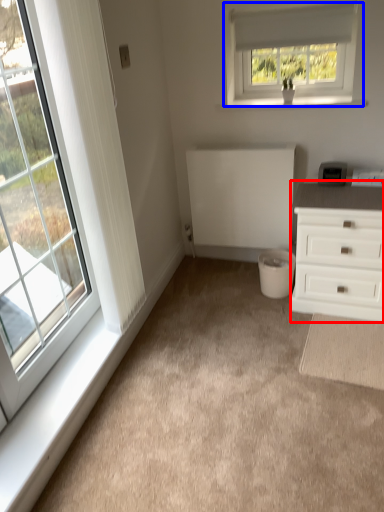
Question: Which of the following is the closest to the observer, chest of drawers (highlighted by a red box) or window (highlighted by a blue box)?

Choices:
 (A) chest of drawers
 (B) window

Answer: (A)